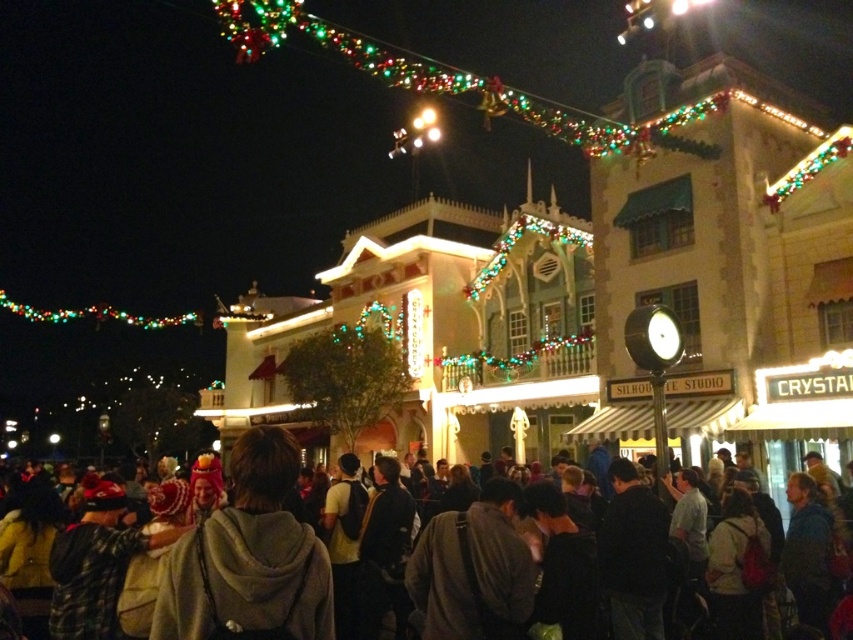
You are a photographer trying to capture the festive lights in the background. You notice the light brown hoodie at center and the multicolored string lights at upper center. Which object is wider in the image?

The multicolored string lights at upper center are wider than the light brown hoodie at center.

Looking at this image, you are a photographer standing in the crowd and want to take a photo of the multicolored string lights at upper center without the dark gray hoodie at center blocking the view. Is it possible?

The dark gray hoodie at center is closer to the viewer than the multicolored string lights at upper center, so the hoodie will block the view of the lights. You need to move to a position where the hoodie is not in front of the lights.